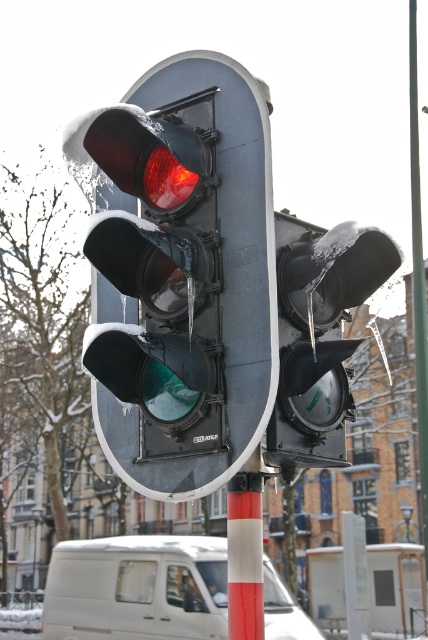
Question: Does transparent ice-covered traffic light at center have a greater width compared to red/white painted pole at center?

Choices:
 (A) yes
 (B) no

Answer: (A)

Question: Which object is farther from the camera taking this photo?

Choices:
 (A) matte black traffic light at center
 (B) transparent ice-covered traffic light at center
 (C) red/white painted pole at center
 (D) white matte van at lower center

Answer: (D)

Question: Does matte black traffic light at center appear on the left side of transparent ice-covered traffic light at center?

Choices:
 (A) no
 (B) yes

Answer: (B)

Question: Which of the following is the closest to the observer?

Choices:
 (A) matte black traffic light at center
 (B) white plastic sign at center

Answer: (A)

Question: Which point appears closest to the camera in this image?

Choices:
 (A) (279, 387)
 (B) (220, 634)
 (C) (350, 616)

Answer: (A)

Question: Is red/white painted pole at center thinner than white plastic sign at center?

Choices:
 (A) yes
 (B) no

Answer: (A)